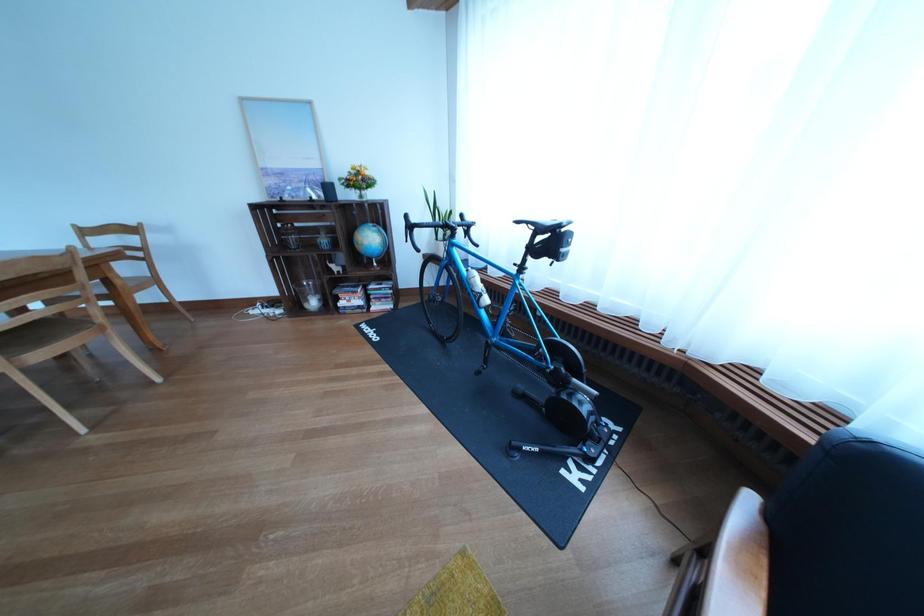
Which object does [309,294] point to?

This point indicates the glass candle holder.